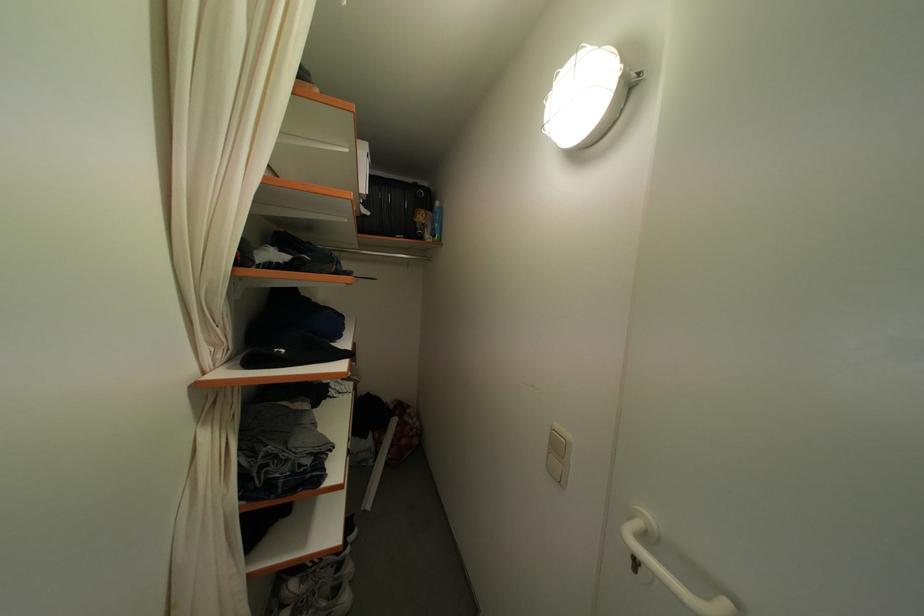
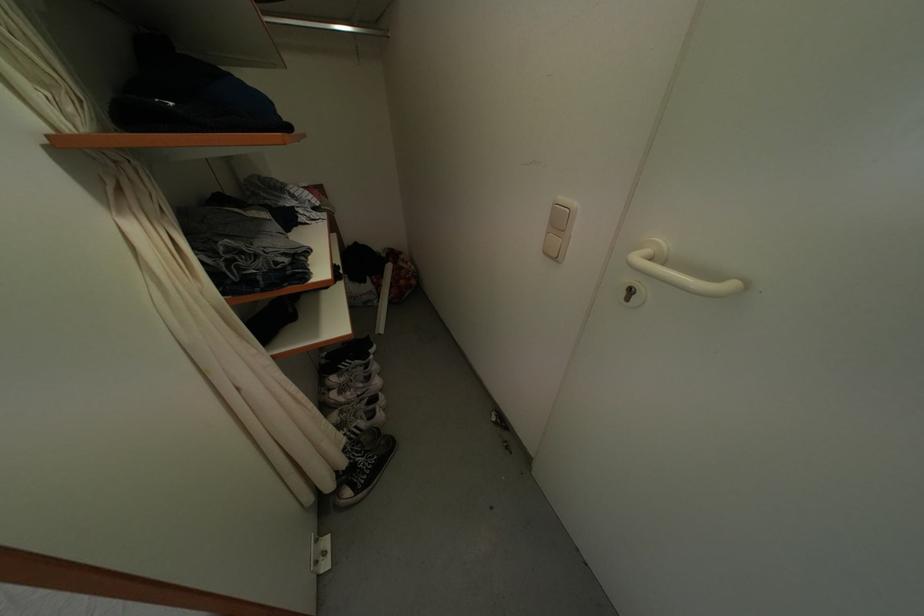
The point at [339,576] is marked in the first image. Where is the corresponding point in the second image?

(369, 374)